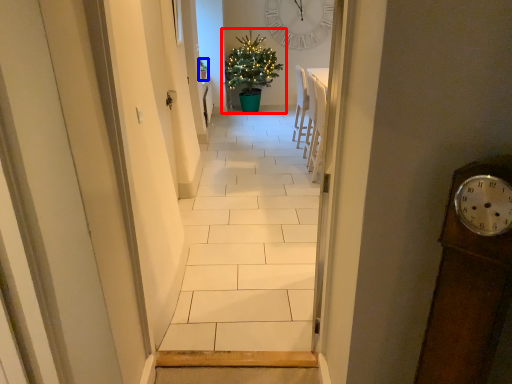
Question: Which point is closer to the camera, christmas tree (highlighted by a red box) or houseplant (highlighted by a blue box)?

Choices:
 (A) christmas tree
 (B) houseplant

Answer: (A)